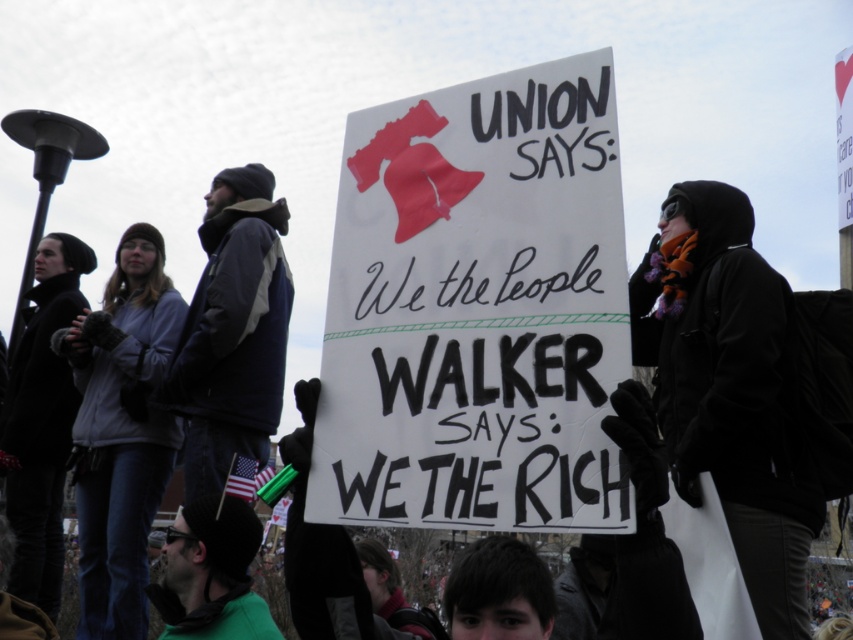
Question: Can you confirm if black woolen scarf at right is bigger than dark blue jacket at center?

Choices:
 (A) no
 (B) yes

Answer: (B)

Question: Which point is closer to the camera taking this photo?

Choices:
 (A) (665, 216)
 (B) (335, 285)
 (C) (256, 451)
 (D) (148, 269)

Answer: (B)

Question: Does white paper sign at center appear on the right side of dark blue jacket at center?

Choices:
 (A) yes
 (B) no

Answer: (A)

Question: Which point is farther to the camera?

Choices:
 (A) [177, 326]
 (B) [654, 314]

Answer: (A)

Question: Among these points, which one is nearest to the camera?

Choices:
 (A) (129, 264)
 (B) (663, 390)
 (C) (358, 273)

Answer: (C)

Question: Can you confirm if white paper sign at center is positioned to the left of dark blue jacket at center?

Choices:
 (A) yes
 (B) no

Answer: (B)